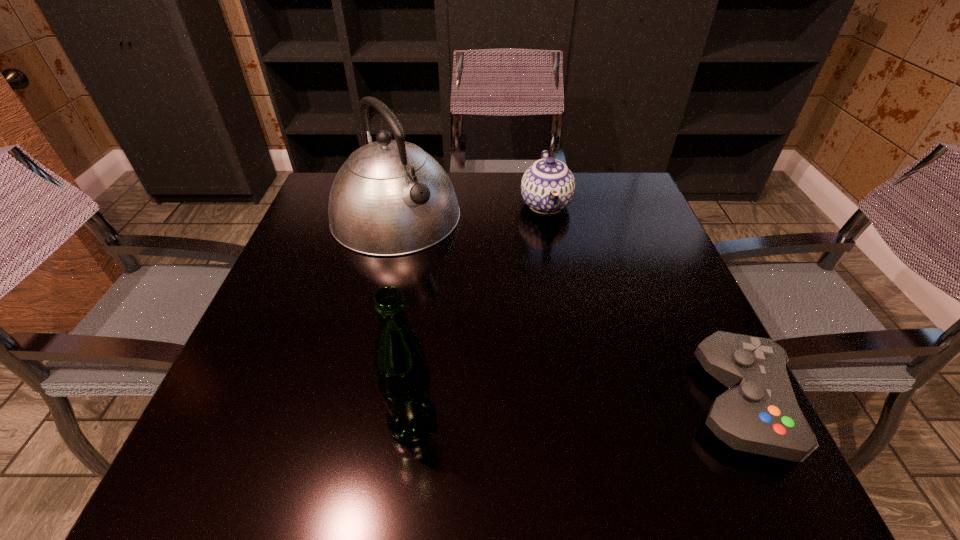
At what (x,y) coordinates should I click in order to perform the action: click on free spot between the chinaware and the rightmost object. Please return your answer as a coordinate pair (x, y). Looking at the image, I should click on (643, 304).

Find the location of a particular element. vacant area that lies between the chinaware and the kettle is located at coordinates (470, 210).

In order to click on free space that is in between the control and the beer bottle in this screenshot , I will do `click(577, 413)`.

Locate an element on the screen. vacant area that lies between the third object from left to right and the control is located at coordinates (643, 304).

Find the location of a particular element. The image size is (960, 540). vacant space that is in between the kettle and the third tallest object is located at coordinates (470, 210).

Identify which object is the third closest to the control. Please provide its 2D coordinates. Your answer should be formatted as a tuple, i.e. [(x, y)], where the tuple contains the x and y coordinates of a point satisfying the conditions above.

[(390, 198)]

Identify the location of object that is the third closest to the third object from left to right. This screenshot has width=960, height=540. (403, 377).

Identify the location of vacant position in the image that satisfies the following two spatial constraints: 1. on the front side of the control; 2. on the left side of the third object from left to right. The height and width of the screenshot is (540, 960). (585, 403).

The height and width of the screenshot is (540, 960). Find the location of `free point that satisfies the following two spatial constraints: 1. on the back side of the kettle; 2. on the left side of the second object from right to left`. free point that satisfies the following two spatial constraints: 1. on the back side of the kettle; 2. on the left side of the second object from right to left is located at coordinates (398, 205).

This screenshot has height=540, width=960. I want to click on free space that satisfies the following two spatial constraints: 1. on the back side of the beer bottle; 2. on the right side of the rightmost object, so click(x=415, y=403).